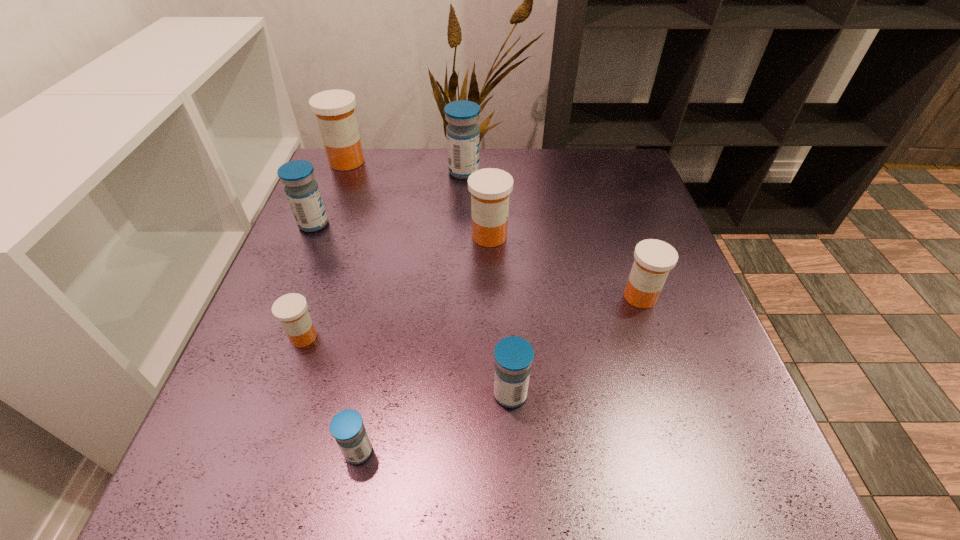
The image size is (960, 540). Find the location of `vacant area that lies between the leftmost blue medicine and the farthest orange medicine`. vacant area that lies between the leftmost blue medicine and the farthest orange medicine is located at coordinates (330, 193).

Find the location of a particular element. This screenshot has height=540, width=960. unoccupied area between the farthest orange medicine and the nearest medicine is located at coordinates (352, 307).

Locate an element on the screen. vacant area that lies between the second blue medicine from right to left and the rightmost blue medicine is located at coordinates (487, 283).

Identify the location of object that stands as the second closest to the nearest orange medicine. The height and width of the screenshot is (540, 960). (302, 191).

Identify which object is the second nearest to the fifth farthest object. Please provide its 2D coordinates. Your answer should be formatted as a tuple, i.e. [(x, y)], where the tuple contains the x and y coordinates of a point satisfying the conditions above.

[(513, 355)]

Identify which medicine is the seventh closest to the second nearest medicine. Please provide its 2D coordinates. Your answer should be formatted as a tuple, i.e. [(x, y)], where the tuple contains the x and y coordinates of a point satisfying the conditions above.

[(334, 109)]

Locate which medicine ranks fourth in proximity to the sixth farthest object. Please provide its 2D coordinates. Your answer should be formatted as a tuple, i.e. [(x, y)], where the tuple contains the x and y coordinates of a point satisfying the conditions above.

[(490, 187)]

Identify which orange medicine is the closest to the rightmost medicine. Please provide its 2D coordinates. Your answer should be formatted as a tuple, i.e. [(x, y)], where the tuple contains the x and y coordinates of a point satisfying the conditions above.

[(490, 187)]

Point out which orange medicine is positioned as the nearest to the nearest blue medicine. Please provide its 2D coordinates. Your answer should be formatted as a tuple, i.e. [(x, y)], where the tuple contains the x and y coordinates of a point satisfying the conditions above.

[(291, 310)]

Identify the location of the closest blue medicine to the smallest blue medicine. (513, 355).